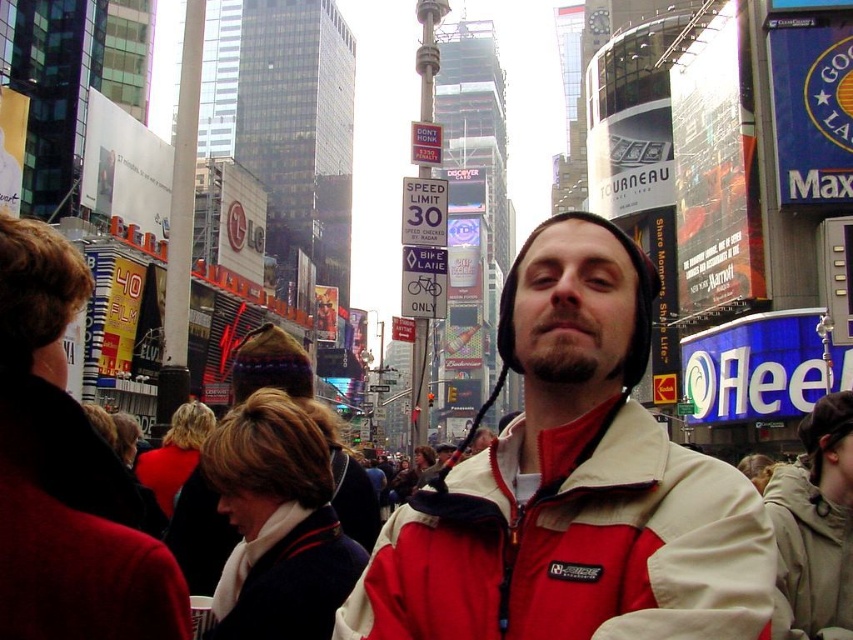
Which is behind, point (584, 413) or point (782, 496)?

Positioned behind is point (782, 496).

Can you confirm if red and white jacket at center is positioned below light gray fleece jacket at lower right?

Actually, red and white jacket at center is above light gray fleece jacket at lower right.

Is point (596, 602) more distant than point (805, 532)?

No, (596, 602) is closer to viewer.

Find the location of a particular element. red and white jacket at center is located at coordinates (572, 484).